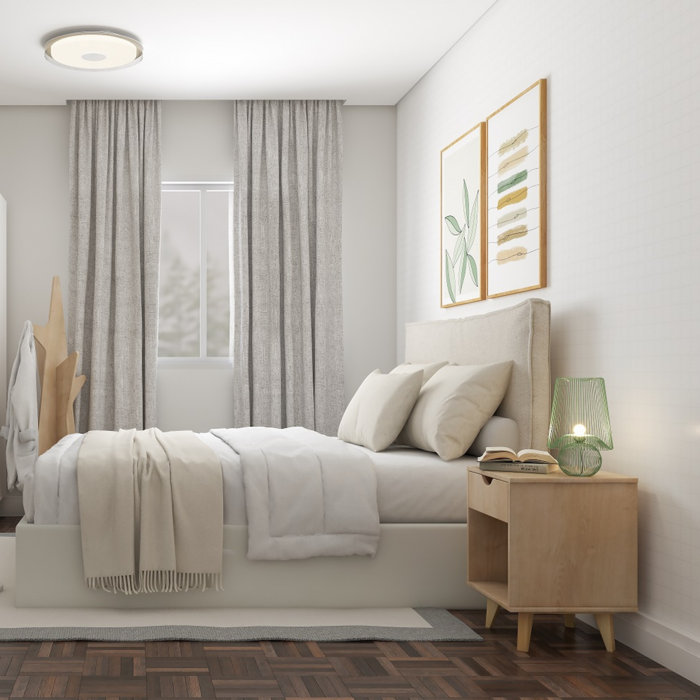
Where is `open book`? The width and height of the screenshot is (700, 700). open book is located at coordinates (483, 458), (505, 453), (526, 458), (547, 458).